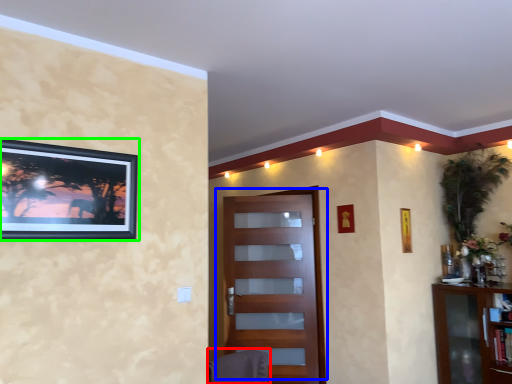
Question: Based on their relative distances, which object is nearer to swivel chair (highlighted by a red box)? Choose from door (highlighted by a blue box) and picture frame (highlighted by a green box).

Choices:
 (A) door
 (B) picture frame

Answer: (B)